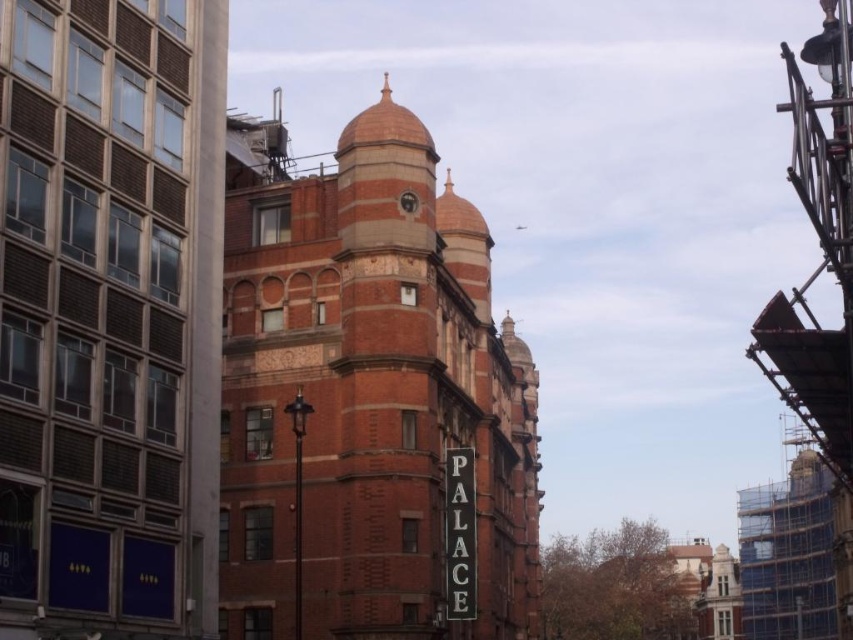
You are standing in the middle of the urban landscape and want to take a photo of the brass metallic clock at center without the red brick building at center blocking it. How should you adjust your position?

The red brick building at center is in front of the brass metallic clock at center, so to avoid blocking the clock, you should move to a position where the clock is no longer behind the building. This could involve moving to the side or behind the building to get a clear view.

You are standing at the origin point in this urban scene. The red brick building at center is located at coordinates 0.620, 0.433. If you want to walk directly towards it from your current position, in which cardinal direction should you head?

The red brick building at center is located at coordinates (x=368, y=396). Since the x and y coordinates are both positive and greater than 0.5, you should head northeast to reach it.